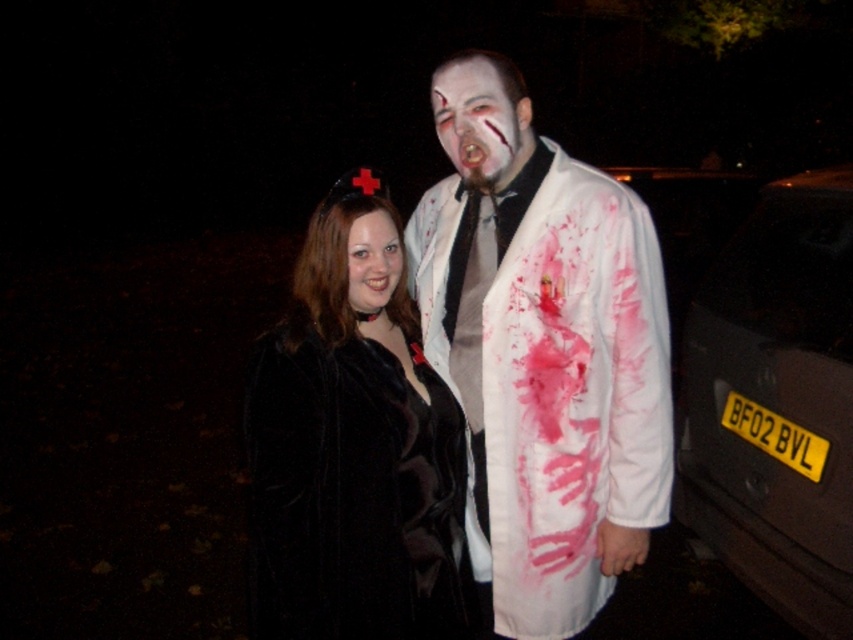
You are a photographer trying to capture a closeup shot of both the white matte face at center and the smooth black hair at center. Given that your camera has a maximum focus range of 30 centimeters, will you be able to capture both subjects in focus without moving the camera?

The white matte face at center and smooth black hair at center are 32.06 centimeters apart from each other. Since the distance between them exceeds the camera maximum focus range of 30 centimeters, you will not be able to capture both subjects in focus without moving the camera.

You are a photographer at a Halloween party. You need to take a photo of the black fur coat at center and the black plastic car at right. Which object is smaller in the photo?

The black fur coat at center is smaller than the black plastic car at right in the photo.